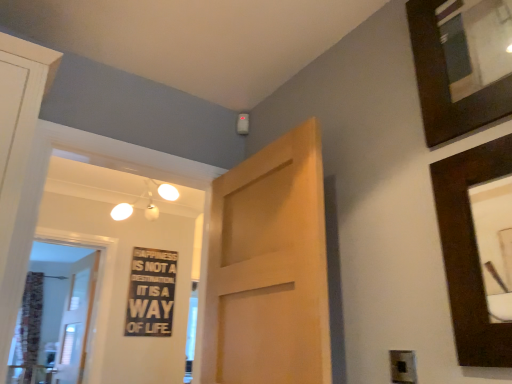
Measure the distance between point (126, 324) and camera.

A distance of 3.34 meters exists between point (126, 324) and camera.

Describe the element at coordinates (76, 320) in the screenshot. This screenshot has height=384, width=512. I see `white wooden door at left, which ranks as the second door in front-to-back order` at that location.

How much space does light brown wood door at center, which is the second door in back-to-front order, occupy horizontally?

It is 5.51 inches.

The image size is (512, 384). I want to click on white glossy light fixture at upper left, so click(148, 202).

At what (x,y) coordinates should I click in order to perform the action: click on dark wood picture frame at upper right, the 1th picture frame ordered from the bottom. Please return your answer as a coordinate pair (x, y). Image resolution: width=512 pixels, height=384 pixels. Looking at the image, I should click on (470, 251).

Identify the location of door above the black plastic electric outlet at lower right (from the image's perspective). (269, 268).

Consider the image. From a real-world perspective, is black plastic electric outlet at lower right positioned under light brown wood door at center, the 1th door in the right-to-left sequence, based on gravity?

Yes, from a real-world perspective, black plastic electric outlet at lower right is under light brown wood door at center, the 1th door in the right-to-left sequence.

Would you say black plastic electric outlet at lower right is to the left or to the right of light brown wood door at center, the 1th door in the right-to-left sequence, in the picture?

In the image, black plastic electric outlet at lower right appears on the right side of light brown wood door at center, the 1th door in the right-to-left sequence.

From the picture: Is black plastic electric outlet at lower right with light brown wood door at center, which is the second door in back-to-front order?

black plastic electric outlet at lower right and light brown wood door at center, which is the second door in back-to-front order, are clearly separated.

Does white wooden door at left, which ranks as the second door in front-to-back order, appear on the right side of dark wood picture frame at upper right, the second picture frame positioned from the top?

Incorrect, white wooden door at left, which ranks as the second door in front-to-back order, is not on the right side of dark wood picture frame at upper right, the second picture frame positioned from the top.

Is there a large distance between white wooden door at left, marked as the first door in a left-to-right arrangement, and dark wood picture frame at upper right, the second picture frame positioned from the top?

Yes.

Is white wooden door at left, marked as the 1th door in a back-to-front arrangement, turned away from dark wood picture frame at upper right, the second picture frame positioned from the top?

No, white wooden door at left, marked as the 1th door in a back-to-front arrangement, is not facing away from dark wood picture frame at upper right, the second picture frame positioned from the top.

Consider the image. Which object is wider, white wooden door at left, marked as the 2th door in a right-to-left arrangement, or dark wood picture frame at upper right, the second picture frame positioned from the top?

Wider between the two is white wooden door at left, marked as the 2th door in a right-to-left arrangement.

Which is farther from the camera, (117, 218) or (304, 211)?

Positioned behind is point (117, 218).

Is white glossy light fixture at upper left positioned behind light brown wood door at center, arranged as the first door when viewed from the front?

That is True.

Is white glossy light fixture at upper left positioned far away from light brown wood door at center, arranged as the first door when viewed from the front?

Yes.

Is white glossy light fixture at upper left aimed at light brown wood door at center, which is the second door in back-to-front order?

No, white glossy light fixture at upper left is not oriented towards light brown wood door at center, which is the second door in back-to-front order.

In the scene shown: Considering the sizes of black plastic electric outlet at lower right and black wood sign at center in the image, is black plastic electric outlet at lower right taller or shorter than black wood sign at center?

Clearly, black plastic electric outlet at lower right is shorter compared to black wood sign at center.

Can you see black plastic electric outlet at lower right touching black wood sign at center?

No, black plastic electric outlet at lower right is not next to black wood sign at center.

Is black plastic electric outlet at lower right inside the boundaries of black wood sign at center, or outside?

black plastic electric outlet at lower right is not enclosed by black wood sign at center.

Is black plastic electric outlet at lower right facing away from black wood sign at center?

black plastic electric outlet at lower right is not turned away from black wood sign at center.

Does light brown wood door at center, which is the 2th door from left to right, have a lesser width compared to black wood sign at center?

No, light brown wood door at center, which is the 2th door from left to right, is not thinner than black wood sign at center.

From the image's perspective, would you say light brown wood door at center, which is the second door in back-to-front order, is positioned over black wood sign at center?

Yes.

In the scene shown: Would you say light brown wood door at center, which is the 2th door from left to right, is outside black wood sign at center?

Absolutely, light brown wood door at center, which is the 2th door from left to right, is external to black wood sign at center.

Considering the relative positions of light brown wood door at center, the 1th door in the right-to-left sequence, and black wood sign at center in the image provided, is light brown wood door at center, the 1th door in the right-to-left sequence, to the left of black wood sign at center from the viewer's perspective?

In fact, light brown wood door at center, the 1th door in the right-to-left sequence, is to the right of black wood sign at center.

Between light brown wood door at center, the 1th door in the right-to-left sequence, and patterned fabric curtain at left, which one is positioned behind?

patterned fabric curtain at left is behind.

In terms of size, does light brown wood door at center, arranged as the first door when viewed from the front, appear bigger or smaller than patterned fabric curtain at left?

light brown wood door at center, arranged as the first door when viewed from the front, is smaller than patterned fabric curtain at left.

Looking at this image, between light brown wood door at center, which is the 2th door from left to right, and patterned fabric curtain at left, which one has more height?

patterned fabric curtain at left.

Does point (298, 312) lie in front of point (27, 287)?

Yes, it is.

Is point (139, 306) closer or farther from the camera than point (223, 282)?

Point (139, 306) is positioned farther from the camera compared to point (223, 282).

Which object is closer to the camera, black wood sign at center or light brown wood door at center, which is the 2th door from left to right?

Positioned in front is light brown wood door at center, which is the 2th door from left to right.

Is black wood sign at center aimed at light brown wood door at center, arranged as the first door when viewed from the front?

Yes, black wood sign at center is aimed at light brown wood door at center, arranged as the first door when viewed from the front.

Which of these two, black wood sign at center or light brown wood door at center, arranged as the first door when viewed from the front, stands shorter?

Standing shorter between the two is black wood sign at center.

You are a GUI agent. You are given a task and a screenshot of the screen. Output one action in this format:
    pyautogui.click(x=<x>, y=<y>)
    Task: Click on the door in front of the black plastic electric outlet at lower right
    The image size is (512, 384).
    Given the screenshot: What is the action you would take?
    pyautogui.click(x=269, y=268)

Locate an element on the screen. The width and height of the screenshot is (512, 384). door below the dark wood picture frame at upper right, the 1th picture frame ordered from the bottom (from a real-world perspective) is located at coordinates [x=76, y=320].

In the scene shown: Estimate the real-world distances between objects in this image. Which object is closer to black wood sign at center, black plastic electric outlet at lower right or dark wood picture frame at upper right, the 1th picture frame ordered from the bottom?

The object closer to black wood sign at center is black plastic electric outlet at lower right.

From the image, which object appears to be farther from white glossy light fixture at upper left, dark wood picture frame at upper right, the second picture frame positioned from the top, or white wooden door at left, marked as the first door in a left-to-right arrangement?

dark wood picture frame at upper right, the second picture frame positioned from the top, is positioned further to the anchor white glossy light fixture at upper left.

Based on the photo, looking at the image, which one is located further to black wood sign at center, light brown wood door at center, which is the 2th door from left to right, or white glossy light fixture at upper left?

light brown wood door at center, which is the 2th door from left to right, is further to black wood sign at center.

Looking at the image, which one is located closer to black plastic electric outlet at lower right, white wooden door at left, marked as the first door in a left-to-right arrangement, or white glossy light fixture at upper left?

Based on the image, white glossy light fixture at upper left appears to be nearer to black plastic electric outlet at lower right.

Based on their spatial positions, is dark wood picture frame at upper right, the second picture frame positioned from the top, or light brown wood door at center, arranged as the first door when viewed from the front, closer to patterned fabric curtain at left?

light brown wood door at center, arranged as the first door when viewed from the front, is closer to patterned fabric curtain at left.

Considering their positions, is dark wood picture frame at upper right, the 1th picture frame ordered from the bottom, positioned closer to white glossy light fixture at upper left than patterned fabric curtain at left?

patterned fabric curtain at left is positioned closer to the anchor white glossy light fixture at upper left.

From the image, which object appears to be nearer to white glossy light fixture at upper left, black wood sign at center or light brown wood door at center, which is the second door in back-to-front order?

Based on the image, black wood sign at center appears to be nearer to white glossy light fixture at upper left.

When comparing their distances from patterned fabric curtain at left, does black plastic electric outlet at lower right or dark wood picture frame at upper right, which is the second picture frame from bottom to top, seem closer?

black plastic electric outlet at lower right lies closer to patterned fabric curtain at left than the other object.

This screenshot has width=512, height=384. What are the coordinates of `electric outlet positioned between dark wood picture frame at upper right, the first picture frame from the top, and white glossy light fixture at upper left from near to far` in the screenshot? It's located at (403, 367).

Locate an element on the screen. The width and height of the screenshot is (512, 384). light fixture between light brown wood door at center, which is the 2th door from left to right, and white wooden door at left, marked as the 2th door in a right-to-left arrangement, in the front-back direction is located at coordinates (148, 202).

At what (x,y) coordinates should I click in order to perform the action: click on electric outlet between light brown wood door at center, the 1th door in the right-to-left sequence, and white glossy light fixture at upper left, along the z-axis. Please return your answer as a coordinate pair (x, y). The image size is (512, 384). Looking at the image, I should click on (403, 367).

At what (x,y) coordinates should I click in order to perform the action: click on electric outlet between light brown wood door at center, arranged as the first door when viewed from the front, and patterned fabric curtain at left from front to back. Please return your answer as a coordinate pair (x, y). Image resolution: width=512 pixels, height=384 pixels. Looking at the image, I should click on (403, 367).